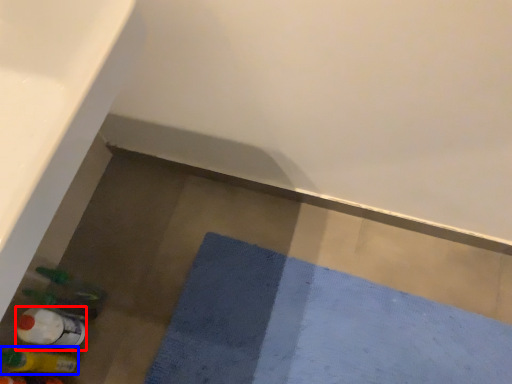
Question: Which point is closer to the camera, bottle (highlighted by a red box) or bottle (highlighted by a blue box)?

Choices:
 (A) bottle
 (B) bottle

Answer: (B)